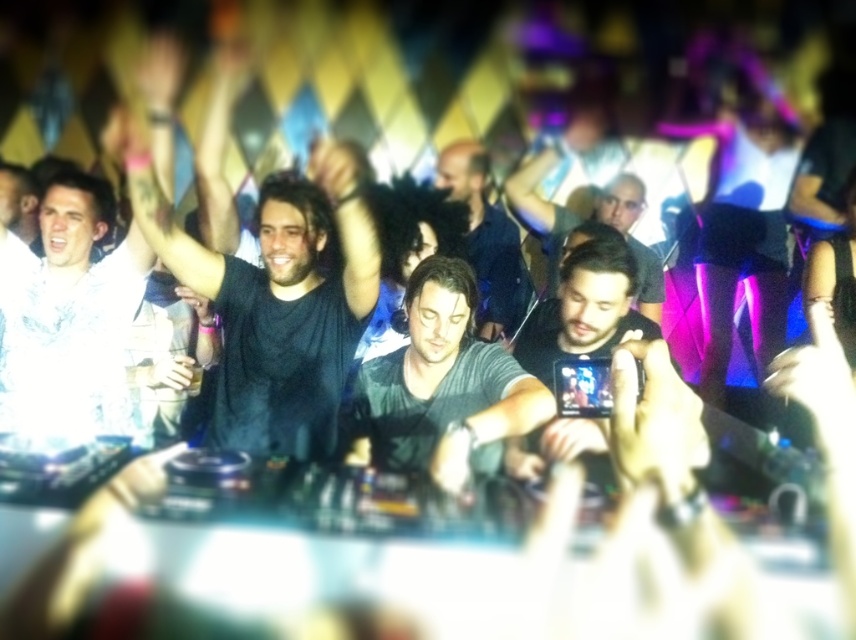
Between gray cotton shirt at center and dark gray shirt at center, which one is positioned lower?

Positioned lower is gray cotton shirt at center.

Does point (494, 364) come in front of point (634, 196)?

No, (494, 364) is behind (634, 196).

Is point (373, 445) farther from viewer compared to point (626, 198)?

Yes, point (373, 445) is behind point (626, 198).

Where is `gray cotton shirt at center`? gray cotton shirt at center is located at coordinates (443, 387).

Does gray cotton shirt at center have a larger size compared to dark blue shirt at center?

Indeed, gray cotton shirt at center has a larger size compared to dark blue shirt at center.

Measure the distance between gray cotton shirt at center and camera.

2.33 meters

Locate an element on the screen. The width and height of the screenshot is (856, 640). gray cotton shirt at center is located at coordinates (443, 387).

Where is `gray cotton shirt at center`? gray cotton shirt at center is located at coordinates (443, 387).

Can you confirm if black matte shirt at center is bigger than white cotton shirt at upper left?

Yes.

Does black matte shirt at center have a lesser height compared to white cotton shirt at upper left?

No, black matte shirt at center is not shorter than white cotton shirt at upper left.

Which is in front, point (330, 388) or point (134, 412)?

Positioned in front is point (330, 388).

What are the coordinates of `black matte shirt at center` in the screenshot? It's located at pos(278,304).